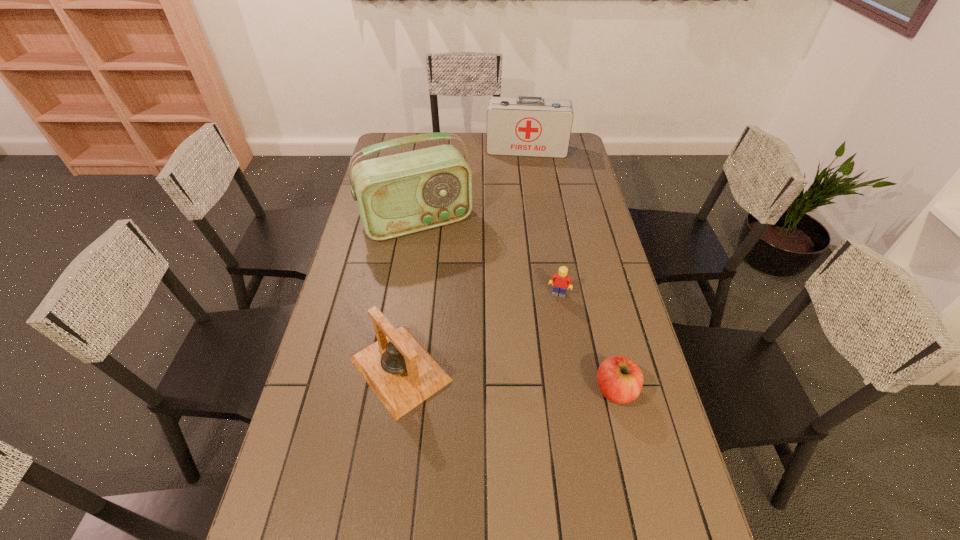
Where is `bell`? The width and height of the screenshot is (960, 540). bell is located at coordinates pos(402,374).

Identify the location of apple. Image resolution: width=960 pixels, height=540 pixels. (620, 380).

Locate an element on the screen. The width and height of the screenshot is (960, 540). the tallest object is located at coordinates 400,194.

I want to click on radio receiver, so click(x=400, y=194).

At what (x,y) coordinates should I click in order to perform the action: click on Lego. Please return your answer as a coordinate pair (x, y). Looking at the image, I should click on (561, 281).

Locate an element on the screen. The image size is (960, 540). the first-aid kit is located at coordinates tap(526, 126).

I want to click on the fourth shortest object, so click(x=526, y=126).

Locate an element on the screen. The height and width of the screenshot is (540, 960). blank space located 0.200m on the back of the third tallest object is located at coordinates (414, 278).

Locate an element on the screen. vacant space located on the left of the apple is located at coordinates (538, 390).

At what (x,y) coordinates should I click in order to perform the action: click on vacant space located on the front panel of the second farthest object. Please return your answer as a coordinate pair (x, y). Looking at the image, I should click on (470, 313).